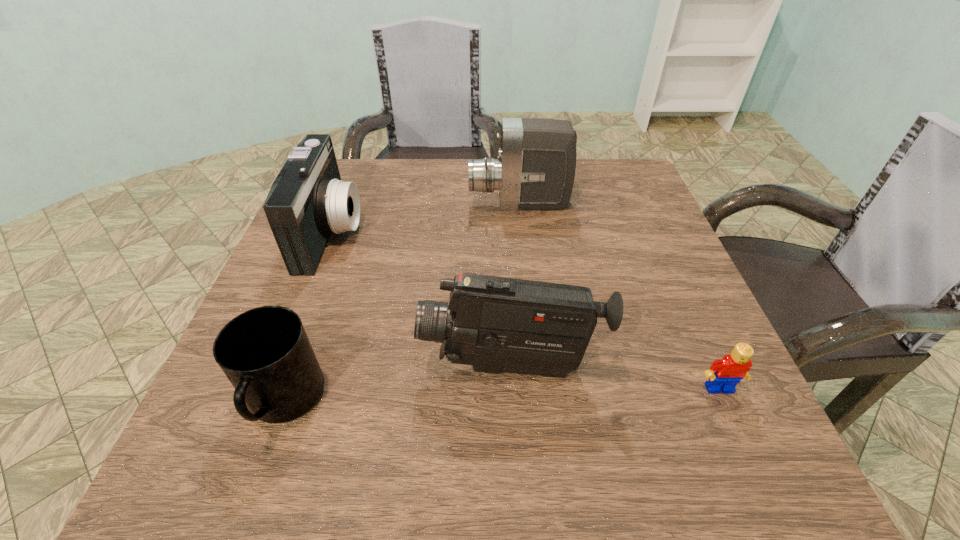
Find the location of `the nearest camcorder`. the nearest camcorder is located at coordinates (496, 324).

Find the location of a particular element. This screenshot has width=960, height=540. the leftmost camcorder is located at coordinates (308, 201).

Image resolution: width=960 pixels, height=540 pixels. I want to click on the fourth tallest object, so click(265, 353).

Identify the location of the rightmost object. (724, 374).

Locate an element on the screen. The height and width of the screenshot is (540, 960). the shortest object is located at coordinates (724, 374).

Locate an element on the screen. The height and width of the screenshot is (540, 960). vacant region located on the front-facing side of the nearest camcorder is located at coordinates (297, 367).

Where is `vacant space located 0.320m on the front-facing side of the nearest camcorder`? This screenshot has width=960, height=540. vacant space located 0.320m on the front-facing side of the nearest camcorder is located at coordinates (231, 367).

This screenshot has width=960, height=540. In order to click on free point located 0.080m on the front-facing side of the nearest camcorder in this screenshot , I will do `click(373, 367)`.

The height and width of the screenshot is (540, 960). Identify the location of vacant area situated on the lens of the leftmost camcorder. [x=399, y=232].

Identify the location of free spot located 0.110m on the front-facing side of the Lego. (753, 464).